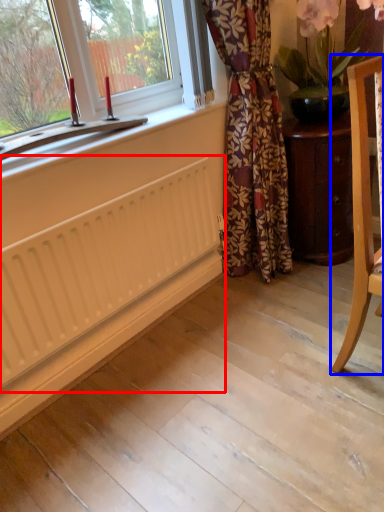
Question: Which object is further to the camera taking this photo, radiator (highlighted by a red box) or chair (highlighted by a blue box)?

Choices:
 (A) radiator
 (B) chair

Answer: (A)